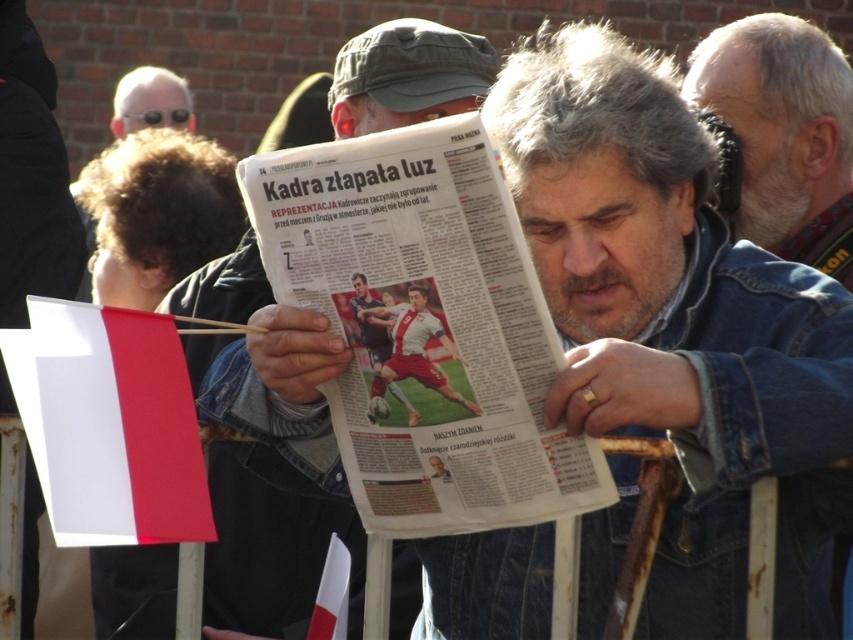
Where is the white paper newspaper at center located in the image?

The white paper newspaper at center is located at point coordinates of [426,326].

You are a photographer at the event and want to capture both the white paper flag at lower left and the white paper flag at lower center in your shot. However, you notice that one is blocking the other. Which flag should you adjust to ensure both are visible?

The white paper flag at lower left is in front of the white paper flag at lower center. To ensure both are visible, you should adjust the white paper flag at lower left to move it aside so the one behind it can be seen.

You are organizing a parade and need to decide which object to use as a flag. The white paper flag at lower left and the matte newspaper at center are available. Which one is thinner and thus more suitable for the parade?

The white paper flag at lower left is thinner than the matte newspaper at center, making it more suitable for the parade.